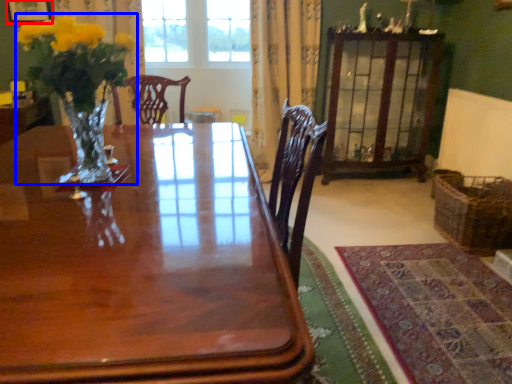
Question: Which point is closer to the camera, picture frame (highlighted by a red box) or floral arrangement (highlighted by a blue box)?

Choices:
 (A) picture frame
 (B) floral arrangement

Answer: (B)